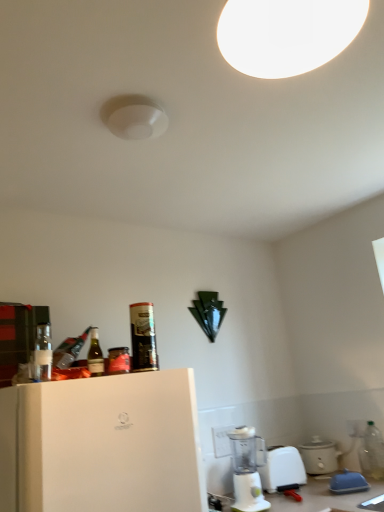
Question: Is white plastic blender at lower center not close to metallic can at upper left, the 2th bottle in the right-to-left sequence?

Choices:
 (A) yes
 (B) no

Answer: (B)

Question: From a real-world perspective, is white plastic blender at lower center under metallic can at upper left, the 3th bottle in the front-to-back sequence?

Choices:
 (A) no
 (B) yes

Answer: (B)

Question: From a real-world perspective, is white plastic blender at lower center positioned over metallic can at upper left, marked as the 4th bottle in a bottom-to-top arrangement, based on gravity?

Choices:
 (A) yes
 (B) no

Answer: (B)

Question: Is white plastic blender at lower center not inside metallic can at upper left, marked as the third bottle in a left-to-right arrangement?

Choices:
 (A) yes
 (B) no

Answer: (A)

Question: Is metallic can at upper left, the 2th bottle in the right-to-left sequence, at the back of white plastic blender at lower center?

Choices:
 (A) yes
 (B) no

Answer: (B)

Question: Is white plastic blender at lower center touching metallic can at upper left, marked as the third bottle in a left-to-right arrangement?

Choices:
 (A) no
 (B) yes

Answer: (A)

Question: Does matte white slow cooker at lower right, the 1th appliance in the back-to-front sequence, come behind metallic can at upper left, the 2th bottle in the right-to-left sequence?

Choices:
 (A) no
 (B) yes

Answer: (B)

Question: Considering the relative sizes of matte white slow cooker at lower right, which appears as the 2th appliance when viewed from the front, and metallic can at upper left, the 3th bottle in the front-to-back sequence, in the image provided, is matte white slow cooker at lower right, which appears as the 2th appliance when viewed from the front, taller than metallic can at upper left, the 3th bottle in the front-to-back sequence,?

Choices:
 (A) no
 (B) yes

Answer: (A)

Question: Is matte white slow cooker at lower right, the 1th appliance in the back-to-front sequence, to the left of metallic can at upper left, marked as the third bottle in a left-to-right arrangement, from the viewer's perspective?

Choices:
 (A) yes
 (B) no

Answer: (B)

Question: Is matte white slow cooker at lower right, which appears as the 2th appliance when viewed from the front, shorter than metallic can at upper left, marked as the 2th bottle in a back-to-front arrangement?

Choices:
 (A) yes
 (B) no

Answer: (A)

Question: From a real-world perspective, is matte white slow cooker at lower right, which appears as the 2th appliance when viewed from the front, positioned under metallic can at upper left, the 2th bottle in the right-to-left sequence, based on gravity?

Choices:
 (A) no
 (B) yes

Answer: (B)

Question: Considering the relative sizes of metallic can at upper left, the 2th bottle in the right-to-left sequence, and clear plastic bottle at lower right, which appears as the 1th bottle when viewed from the back, in the image provided, is metallic can at upper left, the 2th bottle in the right-to-left sequence, shorter than clear plastic bottle at lower right, which appears as the 1th bottle when viewed from the back,?

Choices:
 (A) yes
 (B) no

Answer: (A)